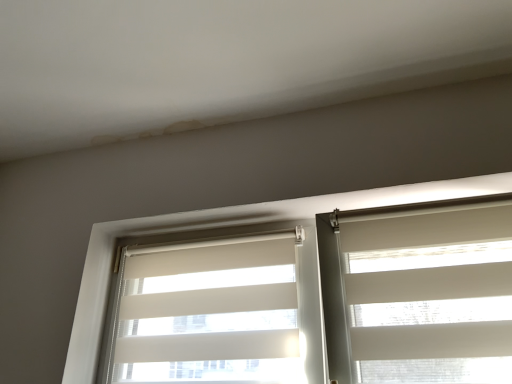
Describe the element at coordinates (228, 225) in the screenshot. I see `white fabric blinds at center` at that location.

Locate an element on the screen. Image resolution: width=512 pixels, height=384 pixels. white fabric blinds at center is located at coordinates (228, 225).

Consider the image. Is white fabric window blind at right, the second window blind when ordered from left to right, not near white fabric blinds at center?

white fabric window blind at right, the second window blind when ordered from left to right, is actually quite close to white fabric blinds at center.

From a real-world perspective, is white fabric window blind at right, the second window blind when ordered from left to right, above or below white fabric blinds at center?

Clearly, from a real-world perspective, white fabric window blind at right, the second window blind when ordered from left to right, is below white fabric blinds at center.

From the image's perspective, is white fabric window blind at right, the second window blind when ordered from left to right, above white fabric blinds at center?

Yes.

From their relative heights in the image, would you say white fabric window blind at right, the first window blind viewed from the right, is taller or shorter than white fabric window blind at left, placed as the 1th window blind when sorted from left to right?

Considering their sizes, white fabric window blind at right, the first window blind viewed from the right, has less height than white fabric window blind at left, placed as the 1th window blind when sorted from left to right.

Considering their positions, is white fabric window blind at right, the second window blind when ordered from left to right, located in front of or behind white fabric window blind at left, placed as the 1th window blind when sorted from left to right?

white fabric window blind at right, the second window blind when ordered from left to right, is in front of white fabric window blind at left, placed as the 1th window blind when sorted from left to right.

In the scene shown: Considering the sizes of objects white fabric window blind at right, the second window blind when ordered from left to right, and white fabric window blind at left, the second window blind viewed from the right, in the image provided, who is bigger, white fabric window blind at right, the second window blind when ordered from left to right, or white fabric window blind at left, the second window blind viewed from the right,?

white fabric window blind at right, the second window blind when ordered from left to right, is bigger.

Consider the image. Does white fabric window blind at right, the first window blind viewed from the right, have a greater width compared to white fabric window blind at left, placed as the 1th window blind when sorted from left to right?

Correct, the width of white fabric window blind at right, the first window blind viewed from the right, exceeds that of white fabric window blind at left, placed as the 1th window blind when sorted from left to right.

Is white fabric blinds at center shorter than white fabric window blind at right, the second window blind when ordered from left to right?

No, white fabric blinds at center is not shorter than white fabric window blind at right, the second window blind when ordered from left to right.

Is white fabric blinds at center positioned with its back to white fabric window blind at right, the first window blind viewed from the right?

Yes, white fabric blinds at center is positioned with its back facing white fabric window blind at right, the first window blind viewed from the right.

Choose the correct answer: Is white fabric blinds at center inside white fabric window blind at right, the second window blind when ordered from left to right, or outside it?

white fabric blinds at center is not inside white fabric window blind at right, the second window blind when ordered from left to right, it's outside.

What's the angular difference between white fabric window blind at left, placed as the 1th window blind when sorted from left to right, and white fabric window blind at right, the second window blind when ordered from left to right,'s facing directions?

white fabric window blind at left, placed as the 1th window blind when sorted from left to right, and white fabric window blind at right, the second window blind when ordered from left to right, are facing 0.000335 degrees away from each other.

From a real-world perspective, is white fabric window blind at left, the second window blind viewed from the right, located beneath white fabric window blind at right, the first window blind viewed from the right?

No, from a real-world perspective, white fabric window blind at left, the second window blind viewed from the right, is not beneath white fabric window blind at right, the first window blind viewed from the right.

Is white fabric window blind at left, placed as the 1th window blind when sorted from left to right, closer to camera compared to white fabric window blind at right, the first window blind viewed from the right?

No, it is behind white fabric window blind at right, the first window blind viewed from the right.

Considering the relative positions of white fabric window blind at left, the second window blind viewed from the right, and white fabric window blind at right, the first window blind viewed from the right, in the image provided, is white fabric window blind at left, the second window blind viewed from the right, to the left of white fabric window blind at right, the first window blind viewed from the right, from the viewer's perspective?

Indeed, white fabric window blind at left, the second window blind viewed from the right, is positioned on the left side of white fabric window blind at right, the first window blind viewed from the right.

From the picture: Is white fabric blinds at center not close to white fabric window blind at left, placed as the 1th window blind when sorted from left to right?

white fabric blinds at center is near white fabric window blind at left, placed as the 1th window blind when sorted from left to right, not far away.

From a real-world perspective, does white fabric blinds at center sit lower than white fabric window blind at left, placed as the 1th window blind when sorted from left to right?

No.

Do you think white fabric blinds at center is within white fabric window blind at left, placed as the 1th window blind when sorted from left to right, or outside of it?

white fabric blinds at center exists outside the volume of white fabric window blind at left, placed as the 1th window blind when sorted from left to right.

How much distance is there between white fabric blinds at center and white fabric window blind at left, the second window blind viewed from the right?

21.36 centimeters.

From the image's perspective, is white fabric window blind at left, placed as the 1th window blind when sorted from left to right, above or below white fabric blinds at center?

white fabric window blind at left, placed as the 1th window blind when sorted from left to right, is situated lower than white fabric blinds at center in the image.

Would you say white fabric window blind at left, placed as the 1th window blind when sorted from left to right, is to the left or to the right of white fabric blinds at center in the picture?

From the image, it's evident that white fabric window blind at left, placed as the 1th window blind when sorted from left to right, is to the left of white fabric blinds at center.

In terms of height, does white fabric window blind at left, placed as the 1th window blind when sorted from left to right, look taller or shorter compared to white fabric blinds at center?

white fabric window blind at left, placed as the 1th window blind when sorted from left to right, is shorter than white fabric blinds at center.

Choose the correct answer: Is white fabric window blind at left, placed as the 1th window blind when sorted from left to right, inside white fabric blinds at center or outside it?

white fabric window blind at left, placed as the 1th window blind when sorted from left to right, exists entirely within white fabric blinds at center.

The width and height of the screenshot is (512, 384). What are the coordinates of `window on the left side of white fabric window blind at right, the second window blind when ordered from left to right` in the screenshot? It's located at (228, 225).

I want to click on window blind located on the right of white fabric window blind at left, the second window blind viewed from the right, so click(x=419, y=292).

Based on their spatial positions, is white fabric blinds at center or white fabric window blind at left, placed as the 1th window blind when sorted from left to right, further from white fabric window blind at right, the first window blind viewed from the right?

Based on the image, white fabric window blind at left, placed as the 1th window blind when sorted from left to right, appears to be further to white fabric window blind at right, the first window blind viewed from the right.

Considering their positions, is white fabric window blind at left, placed as the 1th window blind when sorted from left to right, positioned closer to white fabric blinds at center than white fabric window blind at right, the first window blind viewed from the right?

Among the two, white fabric window blind at left, placed as the 1th window blind when sorted from left to right, is located nearer to white fabric blinds at center.

Estimate the real-world distances between objects in this image. Which object is further from white fabric blinds at center, white fabric window blind at right, the first window blind viewed from the right, or white fabric window blind at left, placed as the 1th window blind when sorted from left to right?

white fabric window blind at right, the first window blind viewed from the right, is positioned further to the anchor white fabric blinds at center.

When comparing their distances from white fabric window blind at left, the second window blind viewed from the right, does white fabric window blind at right, the second window blind when ordered from left to right, or white fabric blinds at center seem closer?

white fabric blinds at center is closer to white fabric window blind at left, the second window blind viewed from the right.

Considering their positions, is white fabric window blind at left, the second window blind viewed from the right, positioned further to white fabric window blind at right, the second window blind when ordered from left to right, than white fabric blinds at center?

white fabric window blind at left, the second window blind viewed from the right.

Based on their spatial positions, is white fabric blinds at center or white fabric window blind at right, the second window blind when ordered from left to right, closer to white fabric window blind at left, placed as the 1th window blind when sorted from left to right?

The object closer to white fabric window blind at left, placed as the 1th window blind when sorted from left to right, is white fabric blinds at center.

Identify the location of window between white fabric window blind at left, placed as the 1th window blind when sorted from left to right, and white fabric window blind at right, the second window blind when ordered from left to right, from left to right. (228, 225).